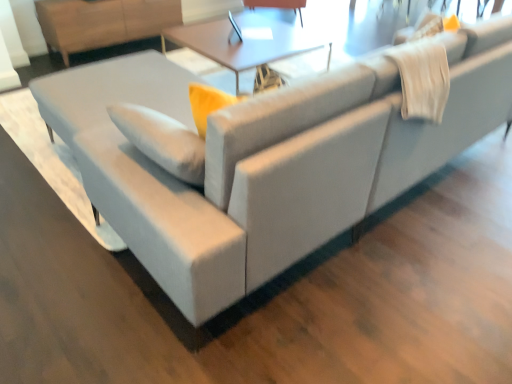
What do you see at coordinates (246, 41) in the screenshot?
I see `matte white table at center` at bounding box center [246, 41].

Identify the location of matte black swivel chair at upper center. (277, 5).

Is matte white table at center oriented towards matte black swivel chair at upper center?

No, matte white table at center is not turned towards matte black swivel chair at upper center.

Looking at this image, is matte white table at center inside the boundaries of matte black swivel chair at upper center, or outside?

matte white table at center is not enclosed by matte black swivel chair at upper center.

Considering the relative sizes of matte white table at center and matte black swivel chair at upper center in the image provided, is matte white table at center bigger than matte black swivel chair at upper center?

Yes.

Is matte white table at center in contact with matte black swivel chair at upper center?

No, matte white table at center is not making contact with matte black swivel chair at upper center.

Does matte black swivel chair at upper center have a greater width compared to matte white table at center?

No, matte black swivel chair at upper center is not wider than matte white table at center.

Would you say matte black swivel chair at upper center is a long distance from matte white table at center?

No.

Does matte black swivel chair at upper center have a greater height compared to matte white table at center?

No, matte black swivel chair at upper center is not taller than matte white table at center.

I want to click on table on the right of the light brown wood dresser at upper left, so click(x=246, y=41).

Does point (63, 14) come in front of point (203, 54)?

That is False.

Based on the photo, visually, is light brown wood dresser at upper left positioned to the left or to the right of matte white table at center?

light brown wood dresser at upper left is to the left of matte white table at center.

From the image's perspective, is light brown wood dresser at upper left located above or below matte white table at center?

light brown wood dresser at upper left is above matte white table at center.

Consider the image. Are matte white table at center and light brown wood dresser at upper left located far from each other?

Yes, matte white table at center is far from light brown wood dresser at upper left.

Find the location of a particular element. This screenshot has width=512, height=384. table beneath the light brown wood dresser at upper left (from a real-world perspective) is located at coordinates (246, 41).

From the picture: Which object is closer to the camera taking this photo, matte white table at center or light brown wood dresser at upper left?

matte white table at center is in front.

Considering the positions of objects light brown wood dresser at upper left and matte black swivel chair at upper center in the image provided, who is in front, light brown wood dresser at upper left or matte black swivel chair at upper center?

Positioned in front is light brown wood dresser at upper left.

From a real-world perspective, is light brown wood dresser at upper left on matte black swivel chair at upper center?

Yes, from a real-world perspective, light brown wood dresser at upper left is over matte black swivel chair at upper center

Could you tell me if light brown wood dresser at upper left is facing matte black swivel chair at upper center?

No.

Would you say light brown wood dresser at upper left is part of matte black swivel chair at upper center's contents?

That's incorrect, light brown wood dresser at upper left is not inside matte black swivel chair at upper center.

Is point (301, 5) positioned after point (87, 6)?

That is True.

From the image's perspective, which one is positioned higher, matte black swivel chair at upper center or light brown wood dresser at upper left?

matte black swivel chair at upper center.

From their relative heights in the image, would you say matte black swivel chair at upper center is taller or shorter than light brown wood dresser at upper left?

Clearly, matte black swivel chair at upper center is shorter compared to light brown wood dresser at upper left.

Identify the location of table on the left of matte black swivel chair at upper center. [246, 41].

In order to click on table in front of the matte black swivel chair at upper center in this screenshot , I will do click(246, 41).

Estimate the real-world distances between objects in this image. Which object is further from matte black swivel chair at upper center, light brown wood dresser at upper left or matte white table at center?

light brown wood dresser at upper left.

Estimate the real-world distances between objects in this image. Which object is further from matte white table at center, light brown wood dresser at upper left or matte black swivel chair at upper center?

Among the two, light brown wood dresser at upper left is located further to matte white table at center.

Estimate the real-world distances between objects in this image. Which object is further from matte black swivel chair at upper center, matte white table at center or light brown wood dresser at upper left?

Based on the image, light brown wood dresser at upper left appears to be further to matte black swivel chair at upper center.

When comparing their distances from matte white table at center, does matte black swivel chair at upper center or light brown wood dresser at upper left seem closer?

Among the two, matte black swivel chair at upper center is located nearer to matte white table at center.

Consider the image. When comparing their distances from light brown wood dresser at upper left, does matte white table at center or matte black swivel chair at upper center seem closer?

matte white table at center is closer to light brown wood dresser at upper left.

Which object lies nearer to the anchor point light brown wood dresser at upper left, matte black swivel chair at upper center or matte white table at center?

The object closer to light brown wood dresser at upper left is matte white table at center.

Where is `dresser between matte white table at center and matte black swivel chair at upper center from front to back`? The width and height of the screenshot is (512, 384). dresser between matte white table at center and matte black swivel chair at upper center from front to back is located at coordinates (103, 22).